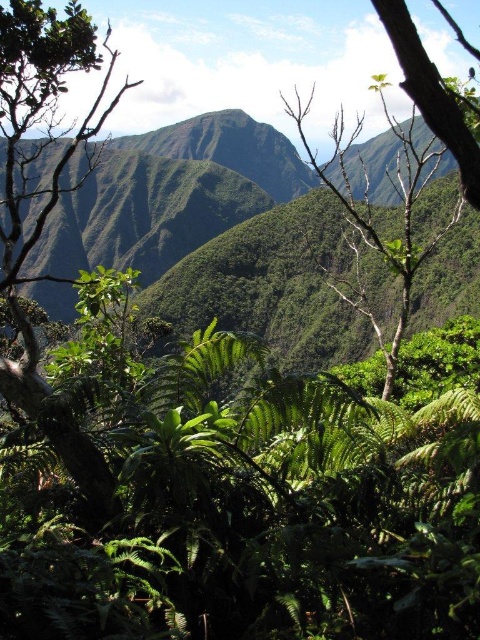
Which of these two, green leafy tree at center or smooth bark tree at upper right, stands shorter?

smooth bark tree at upper right is shorter.

Is green leafy tree at center closer to camera compared to smooth bark tree at upper right?

No, it is not.

Does point (408, 260) lie behind point (464, 193)?

Yes, point (408, 260) is behind point (464, 193).

Image resolution: width=480 pixels, height=640 pixels. In order to click on green leafy tree at center in this screenshot , I will do `click(372, 218)`.